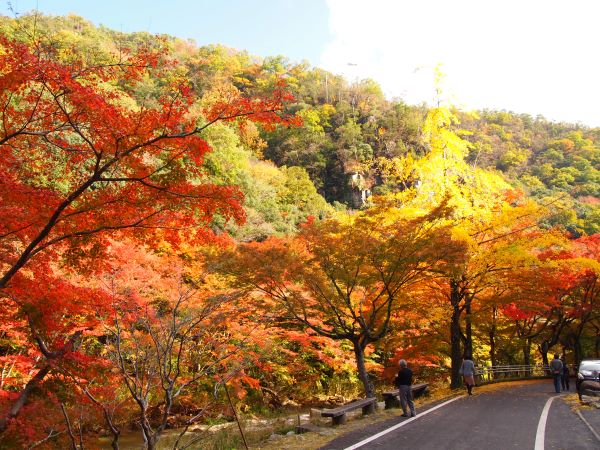
Locate an element on the screen. This screenshot has height=450, width=600. benches is located at coordinates (421, 388), (355, 405).